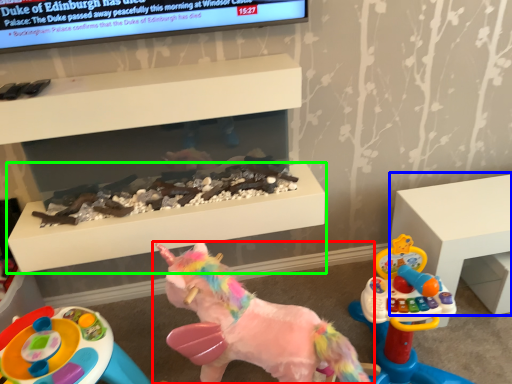
Question: Considering the real-world distances, which object is farthest from toy (highlighted by a red box)? furniture (highlighted by a blue box) or table (highlighted by a green box)?

Choices:
 (A) furniture
 (B) table

Answer: (A)